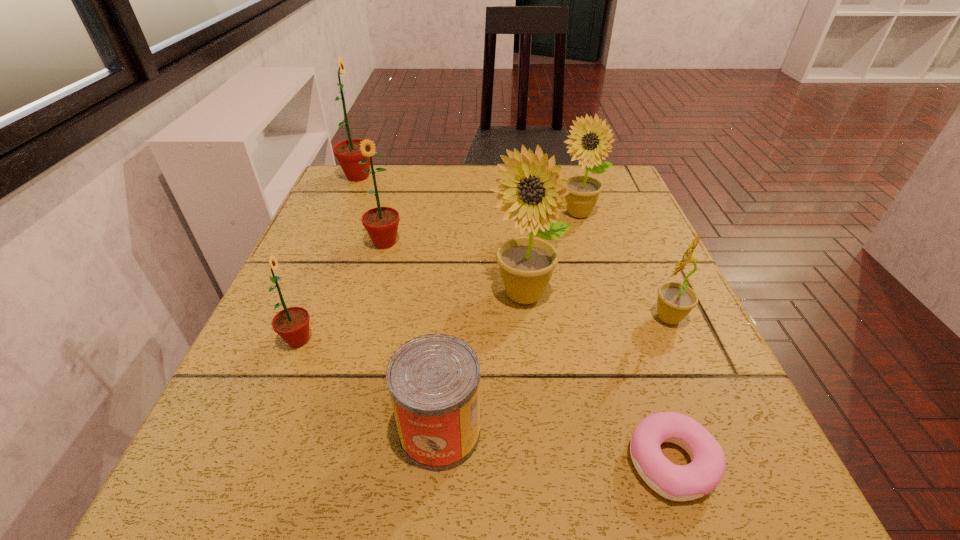
Locate an element on the screen. free space between the shortest object and the rightmost yellow sunflower is located at coordinates (670, 389).

The height and width of the screenshot is (540, 960). In order to click on free spot between the seventh nearest object and the fourth object from left to right in this screenshot , I will do `click(509, 323)`.

At what (x,y) coordinates should I click in order to perform the action: click on empty location between the third farthest sunflower and the second farthest object. Please return your answer as a coordinate pair (x, y). This screenshot has width=960, height=540. Looking at the image, I should click on (481, 228).

This screenshot has height=540, width=960. Identify the location of vacant area that lies between the fourth object from left to right and the rightmost yellow sunflower. (554, 375).

Image resolution: width=960 pixels, height=540 pixels. I want to click on free point between the rightmost green sunflower and the biggest yellow sunflower, so click(x=454, y=269).

Locate an element on the screen. The image size is (960, 540). free space between the pastry and the can is located at coordinates (556, 447).

This screenshot has width=960, height=540. Identify the location of free space between the fourth sunflower from right to left and the pastry. pos(528,352).

Choose which object is the nearest neighbor to the fifth object from left to right. Please provide its 2D coordinates. Your answer should be formatted as a tuple, i.e. [(x, y)], where the tuple contains the x and y coordinates of a point satisfying the conditions above.

[(675, 301)]

Identify which object is the sixth nearest to the can. Please provide its 2D coordinates. Your answer should be formatted as a tuple, i.e. [(x, y)], where the tuple contains the x and y coordinates of a point satisfying the conditions above.

[(588, 147)]

Point out which sunflower is positioned as the fifth nearest to the nearest green sunflower. Please provide its 2D coordinates. Your answer should be formatted as a tuple, i.e. [(x, y)], where the tuple contains the x and y coordinates of a point satisfying the conditions above.

[(675, 301)]